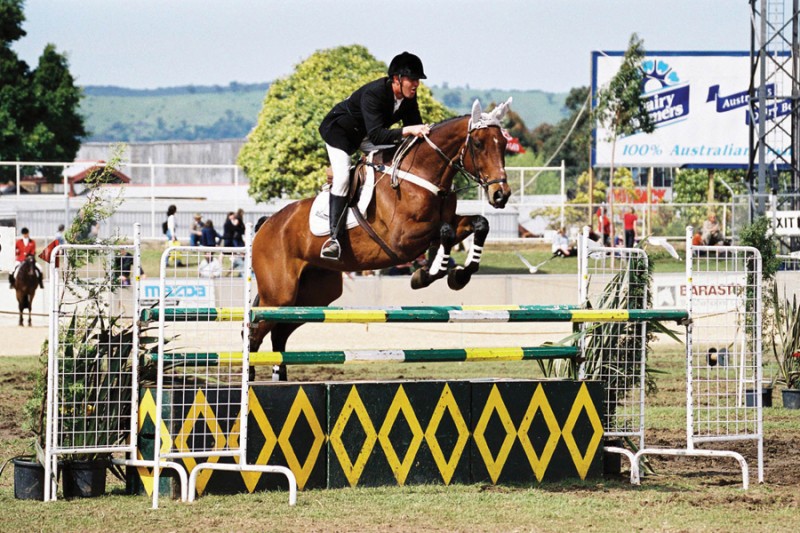
This screenshot has width=800, height=533. What are the coordinates of `pot` in the screenshot? It's located at (26, 482).